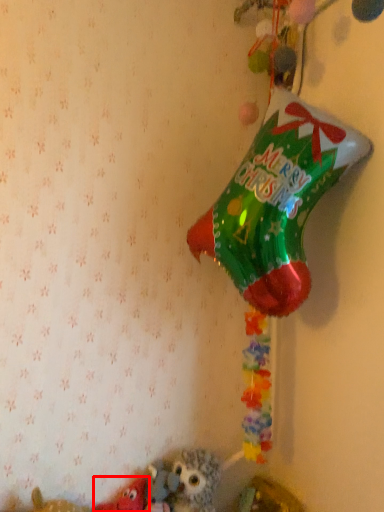
Question: From the image's perspective, what is the correct spatial positioning of toy (annotated by the red box) in reference to toy?

Choices:
 (A) above
 (B) below

Answer: (B)